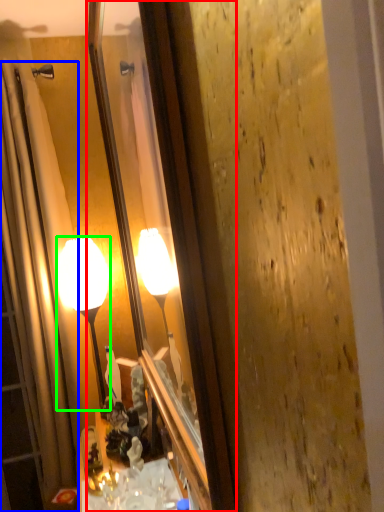
Question: Estimate the real-world distances between objects in this image. Which object is closer to mirror (highlighted by a red box), shower curtain (highlighted by a blue box) or lamp (highlighted by a green box)?

Choices:
 (A) shower curtain
 (B) lamp

Answer: (B)